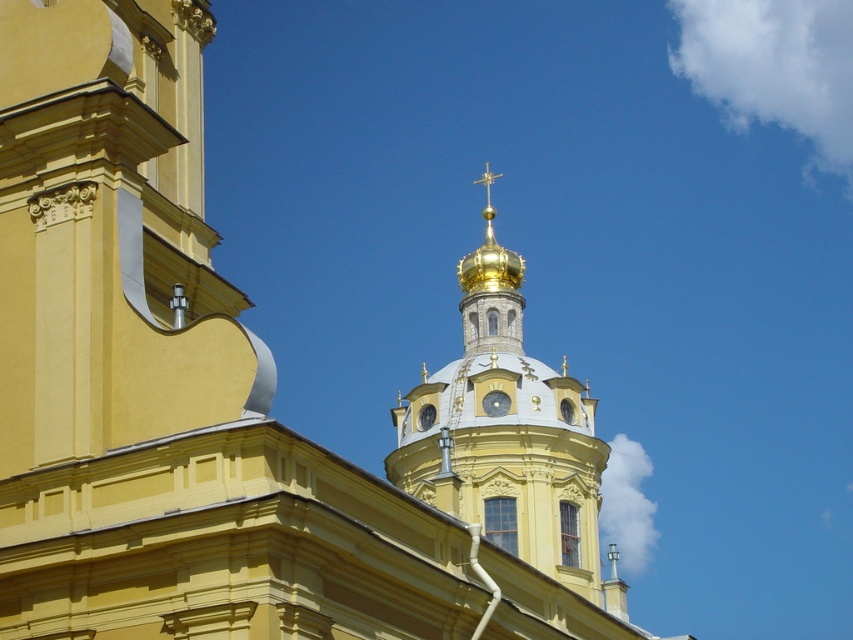
Can you confirm if gold plated dome at center is bigger than silver metallic clock at center?

Indeed, gold plated dome at center has a larger size compared to silver metallic clock at center.

Which is behind, point (564, 449) or point (506, 404)?

The point (506, 404) is behind.

This screenshot has height=640, width=853. Find the location of `gold plated dome at center`. gold plated dome at center is located at coordinates (508, 435).